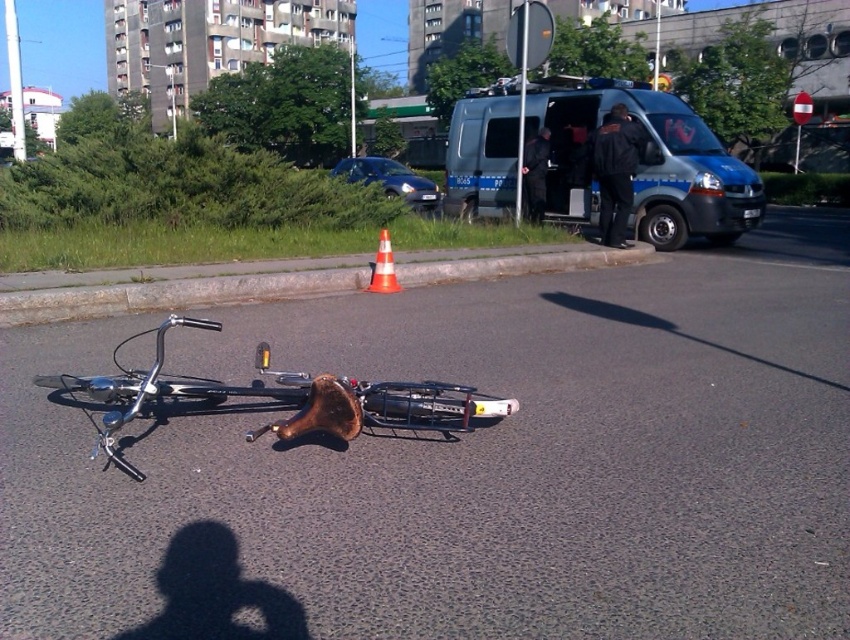
You are a pedestrian who wants to cross the street safely. There is a blue metallic van at center and a bicycle lying on its side on the asphalt road. Which object is closer to you?

The bicycle lying on its side on the asphalt road is closer to you than the blue metallic van at center because they are 17.68 feet apart.

You are a delivery person who needs to park your van behind the blue metallic van at center and the orange plastic traffic cone at center. Can you fit your van behind them without hitting the traffic cone at center?

The blue metallic van at center is much taller than the orange plastic traffic cone at center, so the height difference does not affect parking. However, since the traffic cone is placed on the road, you should avoid hitting it by positioning your van carefully behind the blue metallic van at center, ensuring there is enough space between them.